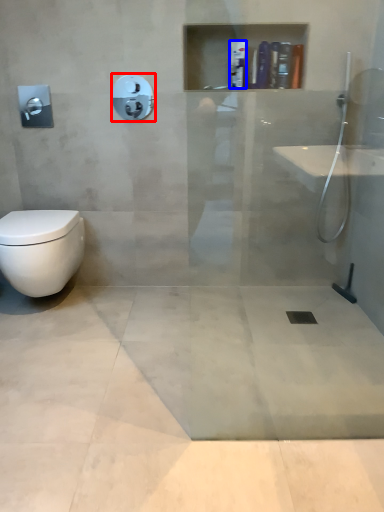
Question: Among these objects, which one is nearest to the camera, shower (highlighted by a red box) or toiletry (highlighted by a blue box)?

Choices:
 (A) shower
 (B) toiletry

Answer: (A)